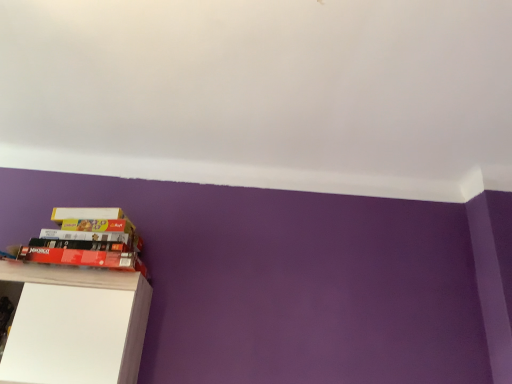
Question: From a real-world perspective, is white matte cabinet at lower left below white matte book at upper left, acting as the 2th paperback book starting from the bottom?

Choices:
 (A) yes
 (B) no

Answer: (A)

Question: Is white matte cabinet at lower left positioned behind white matte book at upper left, acting as the 2th paperback book starting from the bottom?

Choices:
 (A) no
 (B) yes

Answer: (A)

Question: Is white matte cabinet at lower left aimed at white matte book at upper left, acting as the 2th paperback book starting from the bottom?

Choices:
 (A) yes
 (B) no

Answer: (B)

Question: From the image's perspective, is white matte cabinet at lower left under white matte book at upper left, the first paperback book viewed from the top?

Choices:
 (A) yes
 (B) no

Answer: (A)

Question: Is white matte cabinet at lower left not close to white matte book at upper left, the first paperback book viewed from the top?

Choices:
 (A) yes
 (B) no

Answer: (B)

Question: Looking at the image, does red matte paperback book at lower left, which is counted as the second paperback book, starting from the top, seem bigger or smaller compared to white matte book at upper left, the first paperback book viewed from the top?

Choices:
 (A) big
 (B) small

Answer: (A)

Question: From the image's perspective, is red matte paperback book at lower left, which is counted as the second paperback book, starting from the top, located above or below white matte book at upper left, the first paperback book viewed from the top?

Choices:
 (A) above
 (B) below

Answer: (B)

Question: Does point (31, 251) appear closer or farther from the camera than point (69, 213)?

Choices:
 (A) closer
 (B) farther

Answer: (A)

Question: Is red matte paperback book at lower left, which is the first paperback book in bottom-to-top order, in front of or behind white matte book at upper left, the first paperback book viewed from the top, in the image?

Choices:
 (A) front
 (B) behind

Answer: (A)

Question: Looking at their shapes, would you say white matte cabinet at lower left is wider or thinner than white matte book at upper left, acting as the 2th paperback book starting from the bottom?

Choices:
 (A) thin
 (B) wide

Answer: (B)

Question: In terms of size, does white matte cabinet at lower left appear bigger or smaller than white matte book at upper left, acting as the 2th paperback book starting from the bottom?

Choices:
 (A) big
 (B) small

Answer: (A)

Question: Is white matte cabinet at lower left to the left or to the right of white matte book at upper left, the first paperback book viewed from the top, in the image?

Choices:
 (A) right
 (B) left

Answer: (B)

Question: Is white matte cabinet at lower left taller or shorter than white matte book at upper left, acting as the 2th paperback book starting from the bottom?

Choices:
 (A) tall
 (B) short

Answer: (A)

Question: Based on their positions, is white matte book at upper left, the first paperback book viewed from the top, located to the left or right of red matte paperback book at lower left, which is counted as the second paperback book, starting from the top?

Choices:
 (A) right
 (B) left

Answer: (A)

Question: Relative to red matte paperback book at lower left, which is counted as the second paperback book, starting from the top, is white matte book at upper left, acting as the 2th paperback book starting from the bottom, in front or behind?

Choices:
 (A) behind
 (B) front

Answer: (A)